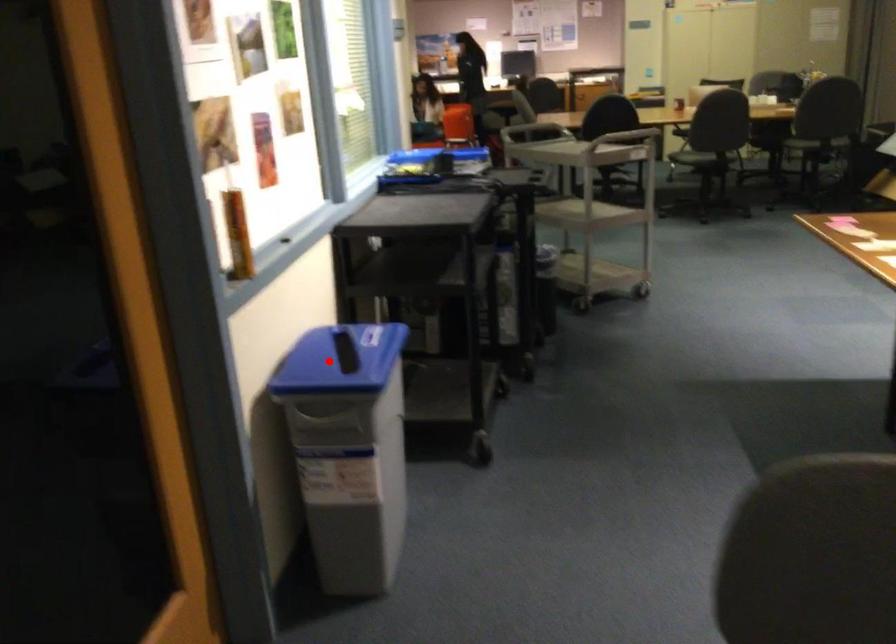
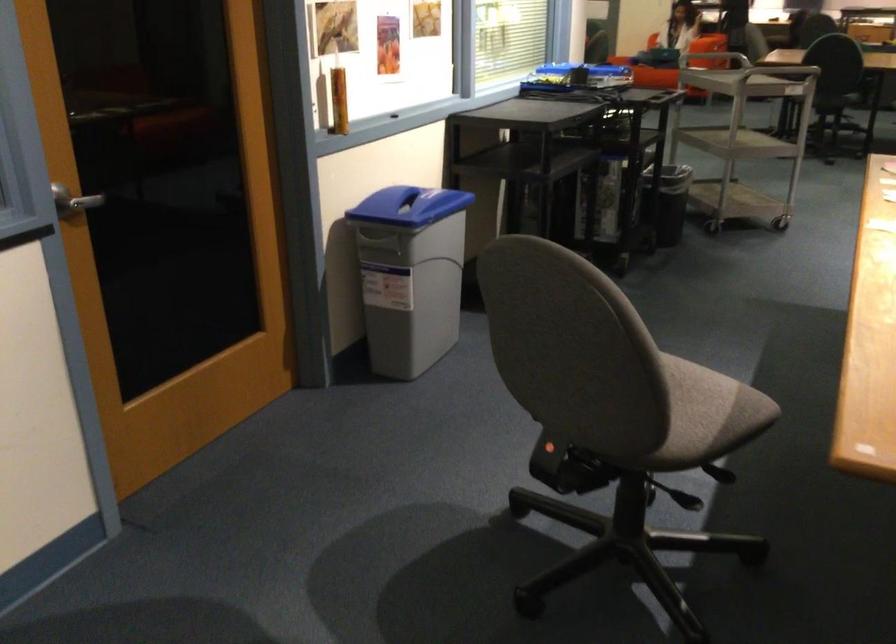
Question: A red point is marked in image1. In image2, is the corresponding 3D point closer to the camera or farther? Reply with the corresponding letter.

Choices:
 (A) The corresponding 3D point is closer.
 (B) The corresponding 3D point is farther.

Answer: (B)